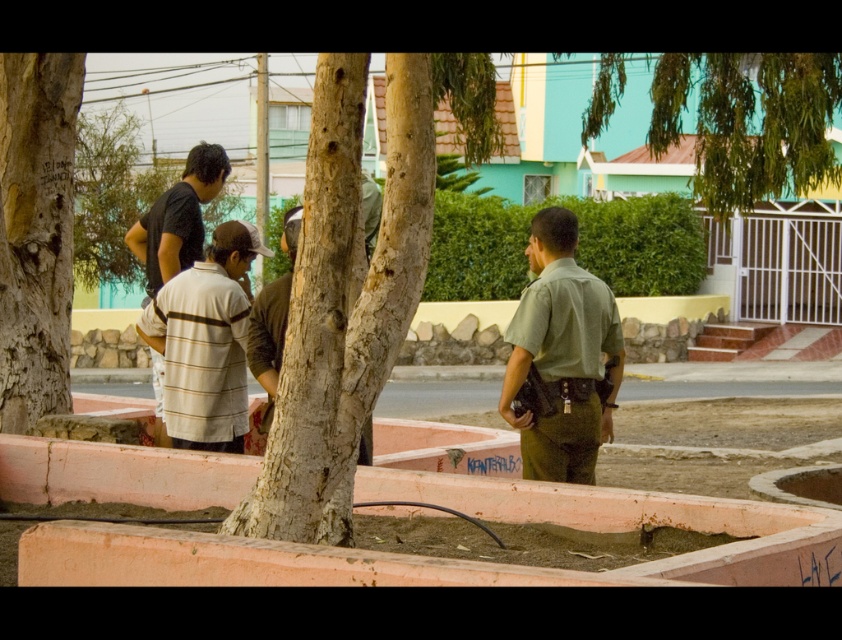
Question: Estimate the real-world distances between objects in this image. Which object is farther from the brown textured shirt at center?

Choices:
 (A) green uniform at center
 (B) striped cotton shirt at center
 (C) striped cotton shirt at left

Answer: (A)

Question: Observing the image, what is the correct spatial positioning of striped cotton shirt at left in reference to brown textured shirt at center?

Choices:
 (A) right
 (B) left

Answer: (B)

Question: Among these objects, which one is nearest to the camera?

Choices:
 (A) striped cotton shirt at left
 (B) green leafy tree at upper right
 (C) brown textured shirt at center
 (D) brown rough bark tree at left

Answer: (C)

Question: Is brown rough bark tree at left closer to camera compared to striped cotton shirt at center?

Choices:
 (A) no
 (B) yes

Answer: (A)

Question: Does green uniform at center have a larger size compared to striped cotton shirt at center?

Choices:
 (A) no
 (B) yes

Answer: (A)

Question: Which of the following is the farthest from the observer?

Choices:
 (A) (210, 196)
 (B) (592, 458)

Answer: (A)